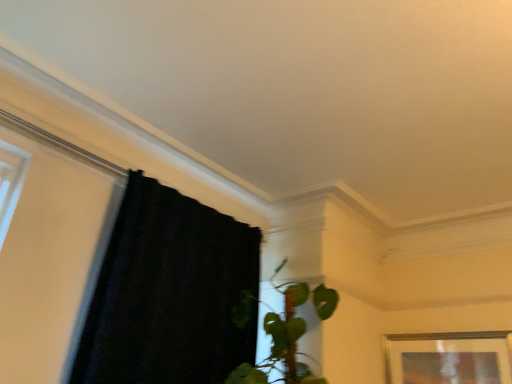
Question: Does black fabric curtain at left lie in front of wooden picture frame at lower right?

Choices:
 (A) no
 (B) yes

Answer: (B)

Question: Considering the relative sizes of black fabric curtain at left and wooden picture frame at lower right in the image provided, is black fabric curtain at left smaller than wooden picture frame at lower right?

Choices:
 (A) no
 (B) yes

Answer: (A)

Question: Considering the relative positions of black fabric curtain at left and wooden picture frame at lower right in the image provided, is black fabric curtain at left behind wooden picture frame at lower right?

Choices:
 (A) no
 (B) yes

Answer: (A)

Question: Is black fabric curtain at left bigger than wooden picture frame at lower right?

Choices:
 (A) yes
 (B) no

Answer: (A)

Question: Is black fabric curtain at left beside wooden picture frame at lower right?

Choices:
 (A) yes
 (B) no

Answer: (B)

Question: From the image's perspective, is black fabric curtain at left above wooden picture frame at lower right?

Choices:
 (A) yes
 (B) no

Answer: (A)

Question: Does wooden picture frame at lower right turn towards black fabric curtain at left?

Choices:
 (A) no
 (B) yes

Answer: (B)

Question: From a real-world perspective, is wooden picture frame at lower right located higher than black fabric curtain at left?

Choices:
 (A) yes
 (B) no

Answer: (B)

Question: Could black fabric curtain at left be considered to be inside wooden picture frame at lower right?

Choices:
 (A) no
 (B) yes

Answer: (A)

Question: Can you confirm if wooden picture frame at lower right is wider than black fabric curtain at left?

Choices:
 (A) yes
 (B) no

Answer: (B)

Question: Can you confirm if wooden picture frame at lower right is smaller than black fabric curtain at left?

Choices:
 (A) yes
 (B) no

Answer: (A)

Question: Is wooden picture frame at lower right behind black fabric curtain at left?

Choices:
 (A) yes
 (B) no

Answer: (A)

Question: Is point (397, 367) positioned closer to the camera than point (158, 352)?

Choices:
 (A) closer
 (B) farther

Answer: (B)